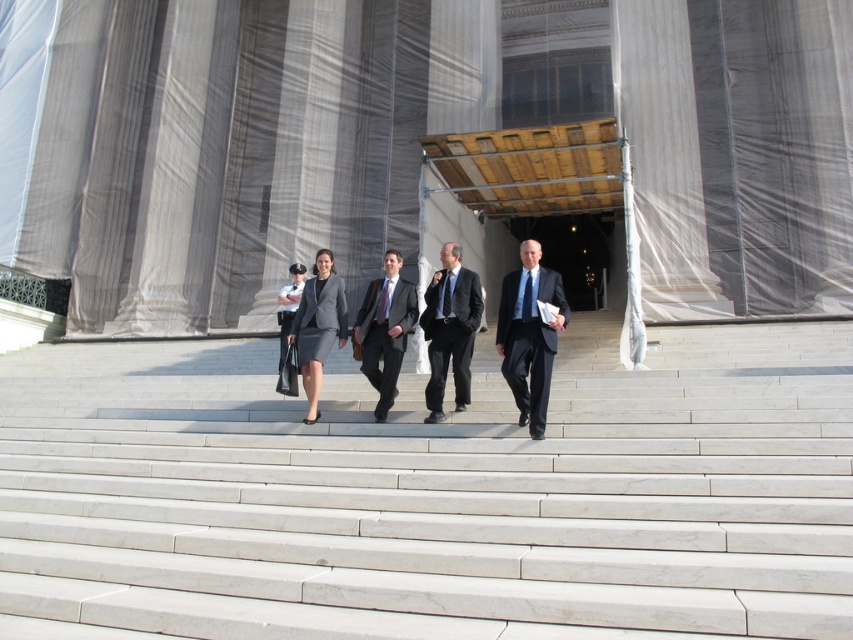
Is matte gray suit at center further to the viewer compared to matte gray dress at center?

No, matte gray suit at center is closer to the viewer.

Can you confirm if matte gray suit at center is smaller than matte gray dress at center?

No.

Does point (296, 320) lie behind point (323, 333)?

Yes, point (296, 320) is farther from viewer.

Where is `matte gray suit at center`? The image size is (853, 640). matte gray suit at center is located at coordinates [x=318, y=326].

Can you confirm if dark blue suit at center is taller than matte gray dress at center?

Yes, dark blue suit at center is taller than matte gray dress at center.

Consider the image. Between dark blue suit at center and matte gray dress at center, which one appears on the left side from the viewer's perspective?

matte gray dress at center is more to the left.

What do you see at coordinates (529, 333) in the screenshot?
I see `dark blue suit at center` at bounding box center [529, 333].

Find the location of a particular element. The width and height of the screenshot is (853, 640). dark blue suit at center is located at coordinates (529, 333).

Is dark blue suit at center to the right of dark gray suit at center from the viewer's perspective?

Correct, you'll find dark blue suit at center to the right of dark gray suit at center.

Does dark blue suit at center appear over dark gray suit at center?

No, dark blue suit at center is not above dark gray suit at center.

Is point (538, 385) less distant than point (447, 253)?

Yes, it is in front of point (447, 253).

The width and height of the screenshot is (853, 640). Find the location of `dark blue suit at center`. dark blue suit at center is located at coordinates (529, 333).